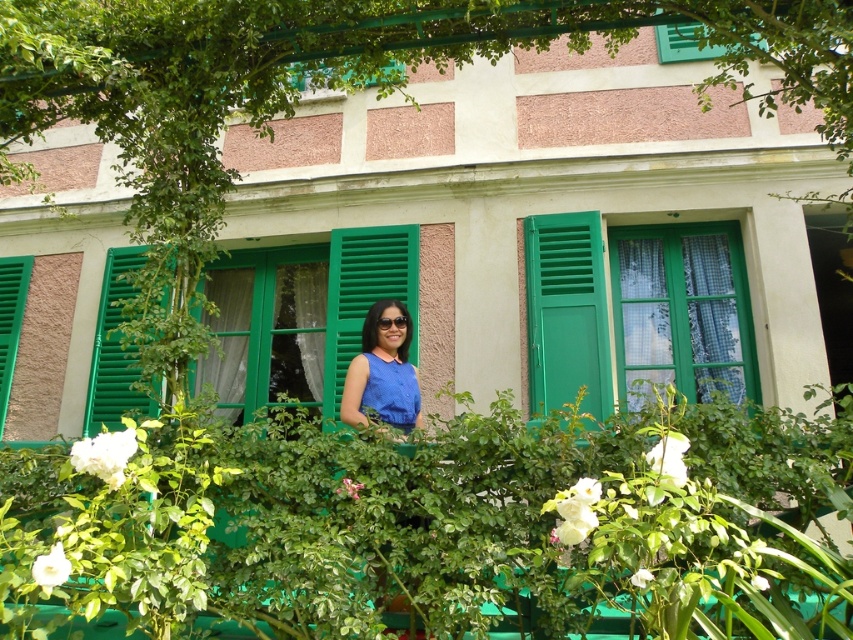
Question: Which object appears farthest from the camera in this image?

Choices:
 (A) green wooden window at center
 (B) green matte window at center
 (C) blue fabric at center

Answer: (A)

Question: Is green matte window at center smaller than blue matte dress at center?

Choices:
 (A) no
 (B) yes

Answer: (A)

Question: Where is green wooden window at center located in relation to blue matte dress at center in the image?

Choices:
 (A) left
 (B) right

Answer: (A)

Question: Considering the real-world distances, which object is closest to the blue matte dress at center?

Choices:
 (A) blue fabric at center
 (B) green matte window at center
 (C) green matte shutter at left
 (D) green wooden window at center

Answer: (A)

Question: Considering the real-world distances, which object is closest to the blue fabric at center?

Choices:
 (A) green wooden window at center
 (B) green matte shutter at left
 (C) blue matte dress at center
 (D) green matte window at center

Answer: (C)

Question: Can you confirm if blue fabric at center is bigger than blue matte dress at center?

Choices:
 (A) no
 (B) yes

Answer: (B)